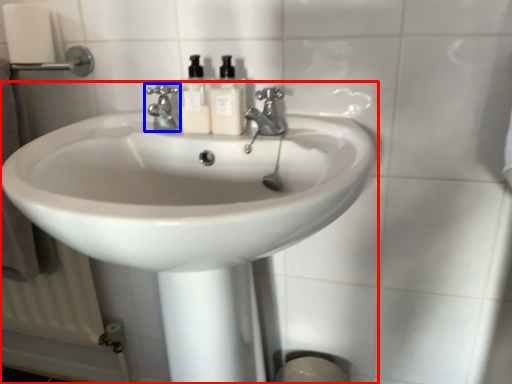
Question: Which object appears closest to the camera in this image, sink (highlighted by a red box) or tap (highlighted by a blue box)?

Choices:
 (A) sink
 (B) tap

Answer: (A)